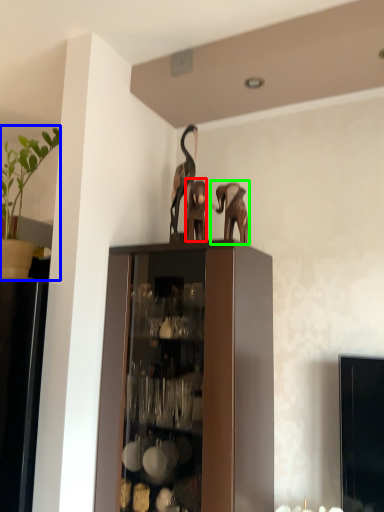
Question: Based on their relative distances, which object is nearer to animal (highlighted by a red box)? Choose from houseplant (highlighted by a blue box) and elephant (highlighted by a green box).

Choices:
 (A) houseplant
 (B) elephant

Answer: (B)